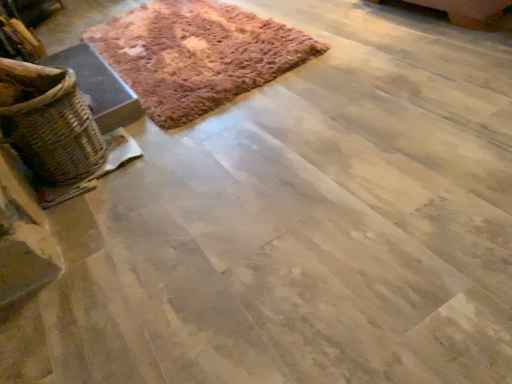
Question: Does point 198,8 appear closer or farther from the camera than point 6,137?

Choices:
 (A) closer
 (B) farther

Answer: (B)

Question: Is brown textured rug at upper left in front of or behind woven brown basket at left in the image?

Choices:
 (A) front
 (B) behind

Answer: (B)

Question: From the image's perspective, is brown textured rug at upper left above or below woven brown basket at left?

Choices:
 (A) above
 (B) below

Answer: (A)

Question: Considering the positions of woven brown basket at left and brown textured rug at upper left in the image, is woven brown basket at left taller or shorter than brown textured rug at upper left?

Choices:
 (A) tall
 (B) short

Answer: (A)

Question: Is woven brown basket at left wider or thinner than brown textured rug at upper left?

Choices:
 (A) thin
 (B) wide

Answer: (A)

Question: Is woven brown basket at left situated inside brown textured rug at upper left or outside?

Choices:
 (A) inside
 (B) outside

Answer: (B)

Question: From the image's perspective, is woven brown basket at left positioned above or below brown textured rug at upper left?

Choices:
 (A) below
 (B) above

Answer: (A)